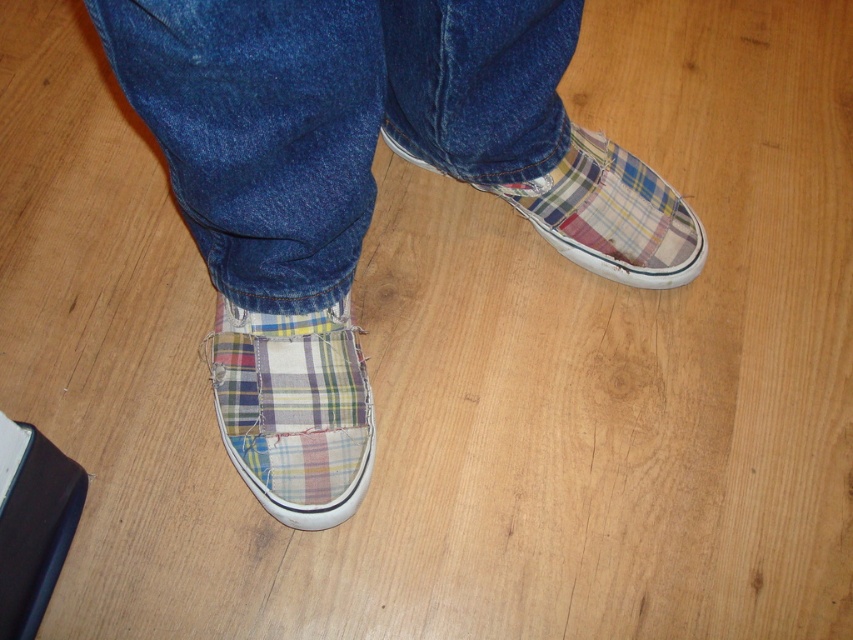
Question: Considering the real-world distances, which object is farthest from the plaid fabric slip-on shoe at lower right?

Choices:
 (A) denim at center
 (B) plaid fabric slip-on shoe at lower center
 (C) plaid fabric slip-on shoe at center

Answer: (B)

Question: Is plaid fabric slip-on shoe at lower center positioned behind plaid fabric slip-on shoe at lower right?

Choices:
 (A) no
 (B) yes

Answer: (A)

Question: Is plaid fabric slip-on shoe at center above plaid fabric slip-on shoe at lower right?

Choices:
 (A) yes
 (B) no

Answer: (B)

Question: Which point is farther from the camera taking this photo?

Choices:
 (A) (306, 388)
 (B) (119, 61)
 (C) (135, 67)
 (D) (593, 168)

Answer: (D)

Question: Considering the real-world distances, which object is farthest from the plaid fabric slip-on shoe at lower right?

Choices:
 (A) plaid fabric slip-on shoe at center
 (B) plaid fabric slip-on shoe at lower center

Answer: (B)

Question: Does denim at center appear under plaid fabric slip-on shoe at lower right?

Choices:
 (A) yes
 (B) no

Answer: (B)